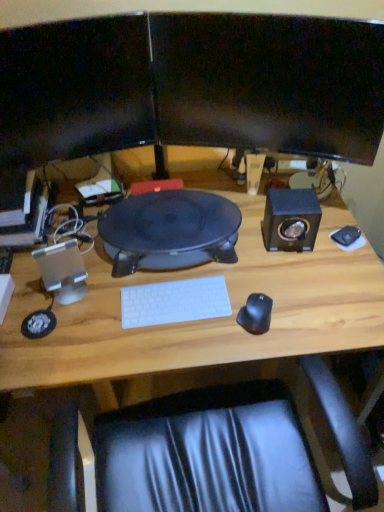
Locate an element on the screen. Image resolution: width=384 pixels, height=512 pixels. vacant area that is in front of black matte speaker at right, arranged as the first speaker when viewed from the top is located at coordinates (297, 280).